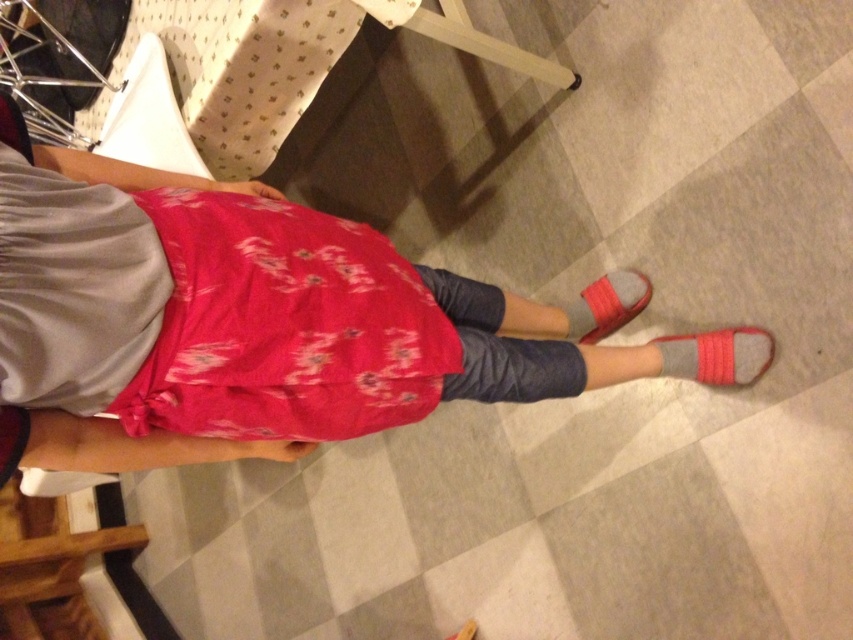
Between floral fabric skirt at center and gray suede sandal at lower right, which one is positioned higher?

gray suede sandal at lower right

Is point (96, 387) farther from camera compared to point (633, 285)?

No, it is in front of (633, 285).

In order to click on floral fabric skirt at center in this screenshot , I will do `click(241, 323)`.

What do you see at coordinates (717, 355) in the screenshot?
I see `gray suede sock at lower right` at bounding box center [717, 355].

Locate an element on the screen. This screenshot has width=853, height=640. gray suede sock at lower right is located at coordinates (717, 355).

Between floral fabric skirt at center and gray suede sock at lower right, which one has less height?

gray suede sock at lower right

Is floral fabric skirt at center to the right of gray suede sock at lower right from the viewer's perspective?

No, floral fabric skirt at center is not to the right of gray suede sock at lower right.

Is point (112, 205) more distant than point (747, 378)?

No.

Where is `floral fabric skirt at center`? floral fabric skirt at center is located at coordinates (241, 323).